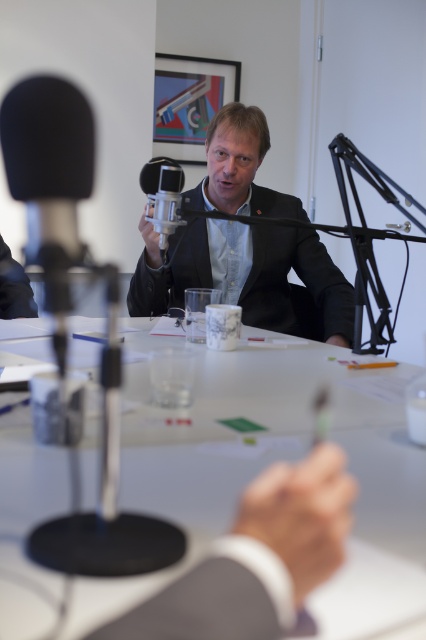
You are a sound technician in the studio. You need to adjust the microphone to ensure the speaker is heard clearly. The microphone is the satin black microphone at center. The speaker is wearing the matte black suit at center. Based on their positions, should you move the microphone up or down to optimize sound quality?

The matte black suit at center is positioned under the satin black microphone at center, so you should move the microphone down to bring it closer to the speaker wearing the matte black suit at center for better sound quality.

You are setting up a recording studio and need to place a 12 inch wide equipment box between the white glossy table at center and the satin black microphone at center. Can you fit it there?

The white glossy table at center might be wider than the satin black microphone at center, so it is uncertain if the 12 inch wide equipment box can fit between them without further information about their exact dimensions.